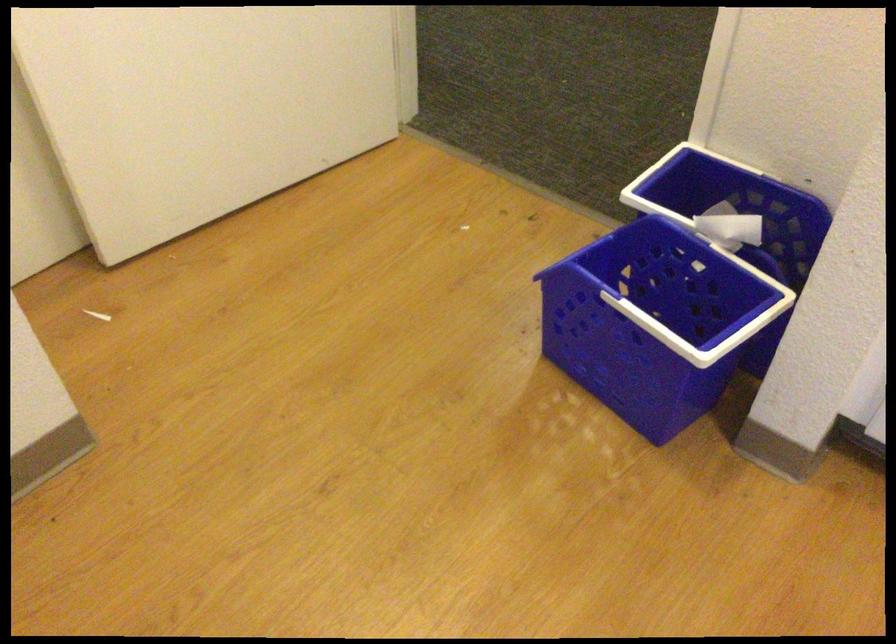
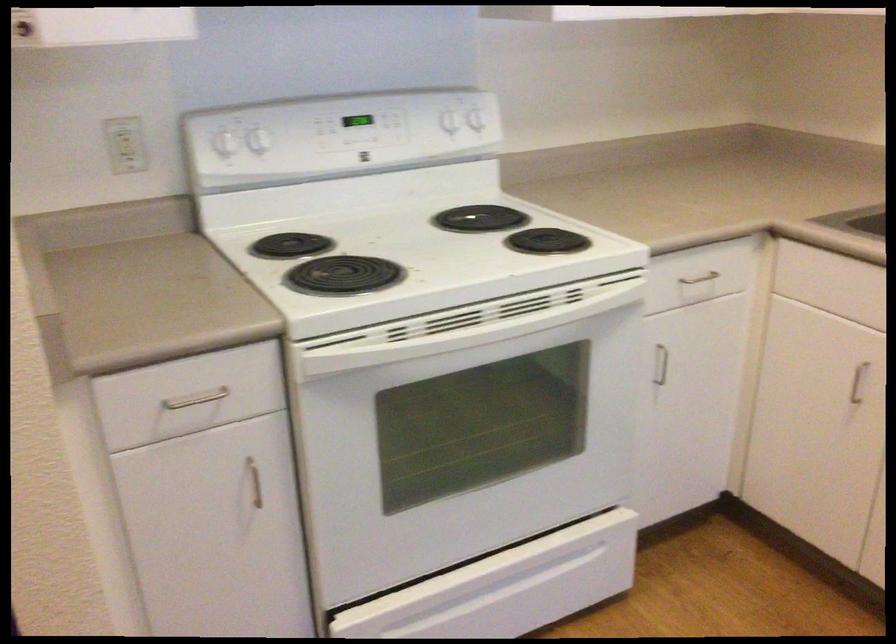
Question: The images are taken continuously from a first-person perspective. In which direction is your viewpoint rotating?

Choices:
 (A) Left
 (B) Right
 (C) Up
 (D) Down

Answer: (B)